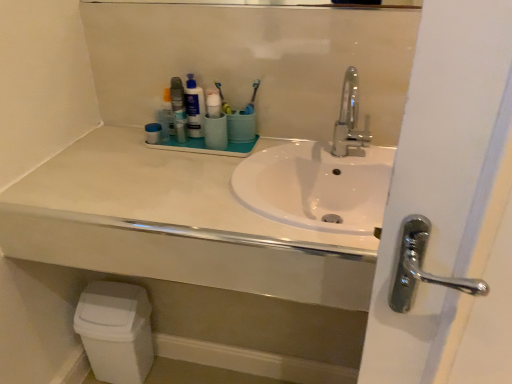
Locate an element on the screen. The image size is (512, 384). vacant space in front of matte blue cup at center, the third toiletry when ordered from left to right is located at coordinates (209, 165).